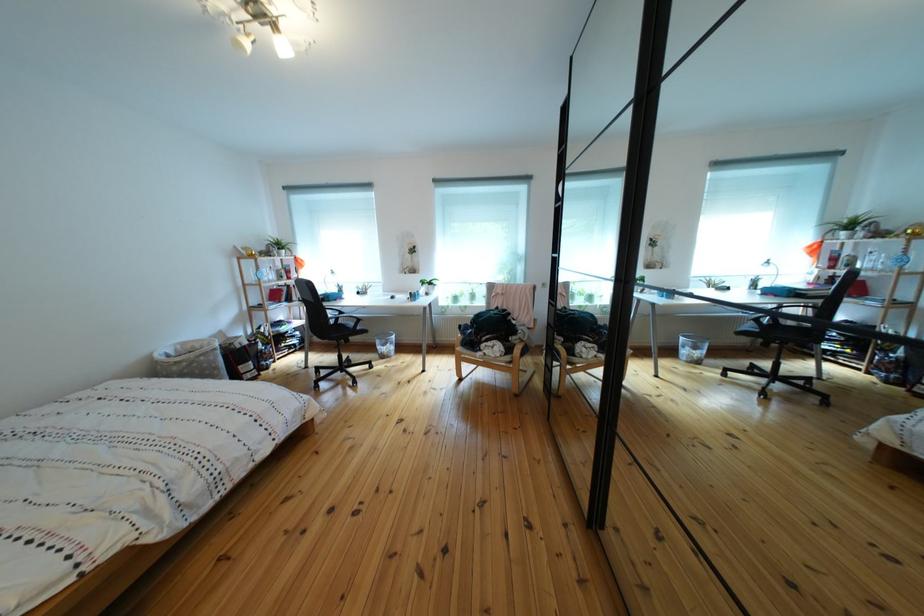
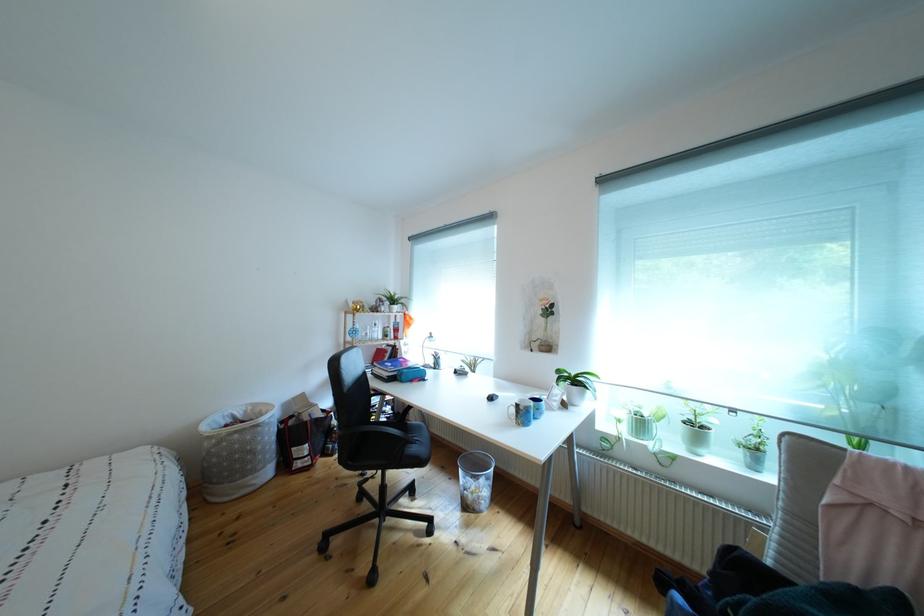
Where in the second image is the point corresponding to (x=421, y=299) from the first image?

(529, 411)